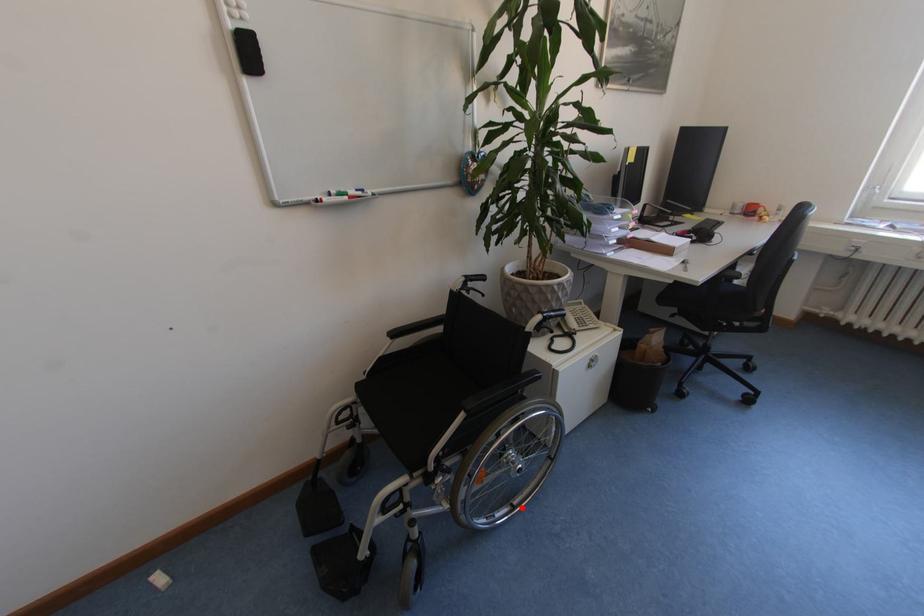
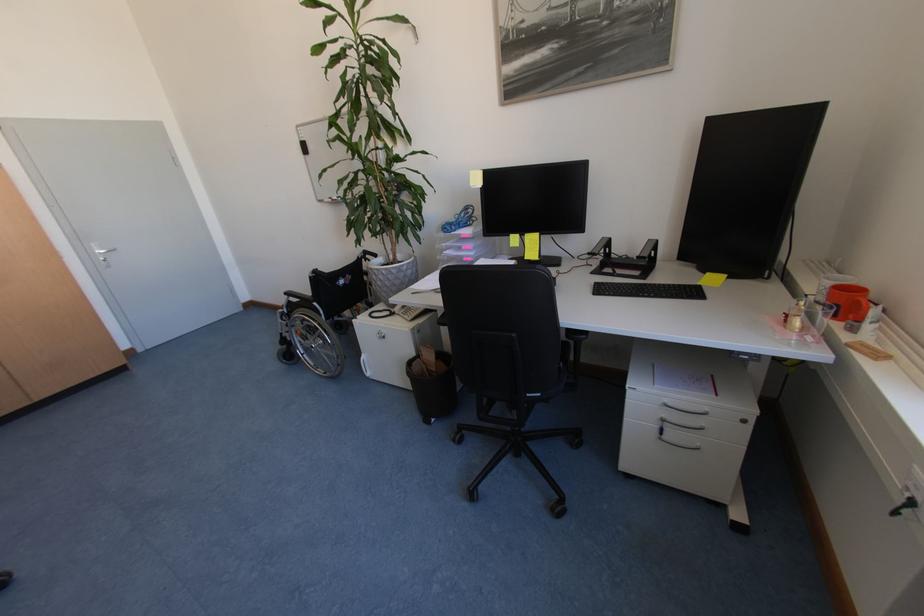
Question: I am providing you with two images of the same scene from different viewpoints. Given a red point in image1, look at the same physical point in image2. Is it:

Choices:
 (A) Closer to the viewpoint
 (B) Farther from the viewpoint

Answer: (A)